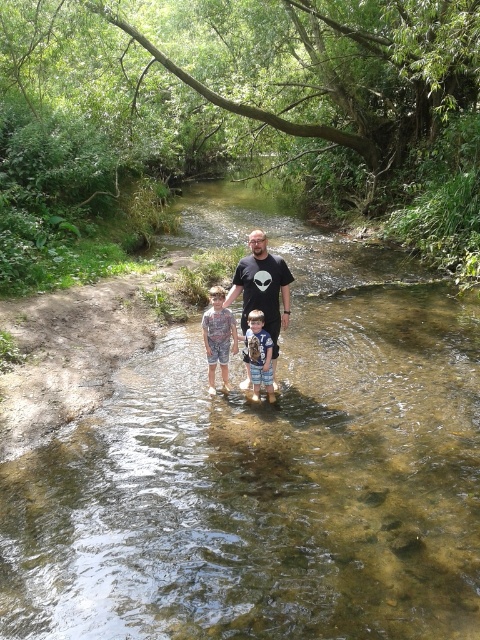
Is camouflage shorts at center taller than light blue denim shorts at center?

Yes.

Does camouflage shorts at center have a larger size compared to light blue denim shorts at center?

Yes.

Measure the distance between point (x=201, y=324) and camera.

32.01 feet

Identify the location of camouflage shorts at center. The image size is (480, 640). (217, 337).

This screenshot has width=480, height=640. What do you see at coordinates (263, 289) in the screenshot?
I see `black matte t-shirt at center` at bounding box center [263, 289].

Does black matte t-shirt at center have a greater width compared to light blue denim shorts at center?

Indeed, black matte t-shirt at center has a greater width compared to light blue denim shorts at center.

Is point (264, 237) behind point (261, 310)?

That is True.

Locate an element on the screen. This screenshot has width=480, height=640. black matte t-shirt at center is located at coordinates (263, 289).

Is black matte t-shirt at center to the left of camouflage shorts at center from the viewer's perspective?

No, black matte t-shirt at center is not to the left of camouflage shorts at center.

Does black matte t-shirt at center appear under camouflage shorts at center?

Incorrect, black matte t-shirt at center is not positioned below camouflage shorts at center.

Does point (245, 362) lie in front of point (217, 317)?

No, (245, 362) is further to viewer.

Find the location of `black matte t-shirt at center`. black matte t-shirt at center is located at coordinates (263, 289).